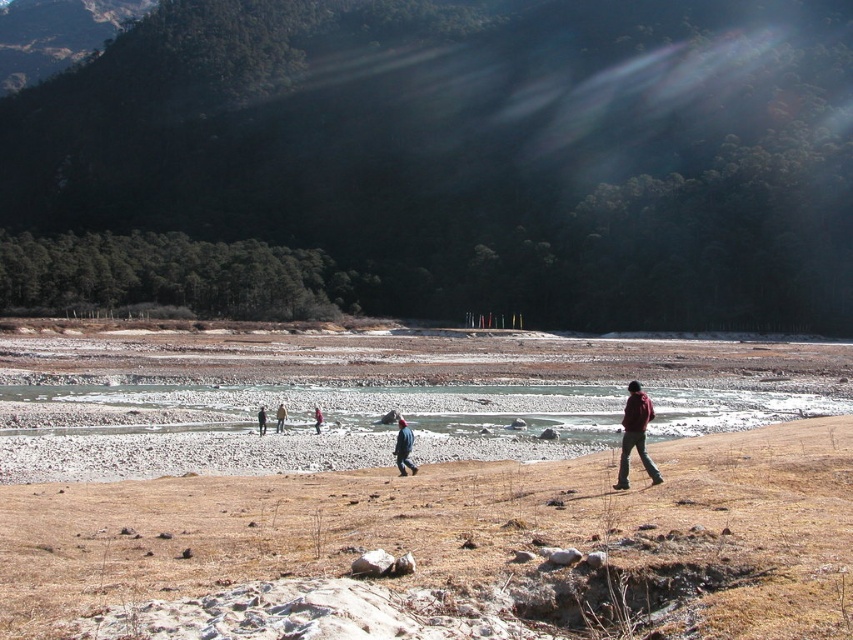
Question: Observing the image, what is the correct spatial positioning of dark red jacket at right in reference to dark blue jacket at center?

Choices:
 (A) left
 (B) right

Answer: (B)

Question: Among these points, which one is farthest from the camera?

Choices:
 (A) (314, 426)
 (B) (258, 426)
 (C) (277, 417)
 (D) (625, 563)

Answer: (A)

Question: Can you confirm if dark red jacket at right is bigger than red woolen jacket at center?

Choices:
 (A) no
 (B) yes

Answer: (B)

Question: Can you confirm if dark red jacket at right is positioned below dark blue jacket at center?

Choices:
 (A) no
 (B) yes

Answer: (A)

Question: Based on their relative distances, which object is farther from the dark red jacket at right?

Choices:
 (A) brown dry grass at lower center
 (B) brown leather jacket at center
 (C) denim jacket at center
 (D) red woolen jacket at center

Answer: (B)

Question: Which object is positioned closest to the dark blue jacket at center?

Choices:
 (A) dark red jacket at right
 (B) denim jacket at center
 (C) brown leather jacket at center

Answer: (C)